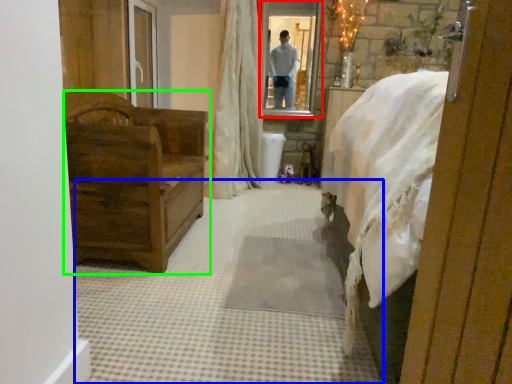
Question: Which is nearer to the mirror (highlighted by a red box)? plain (highlighted by a blue box) or furniture (highlighted by a green box).

Choices:
 (A) plain
 (B) furniture

Answer: (B)